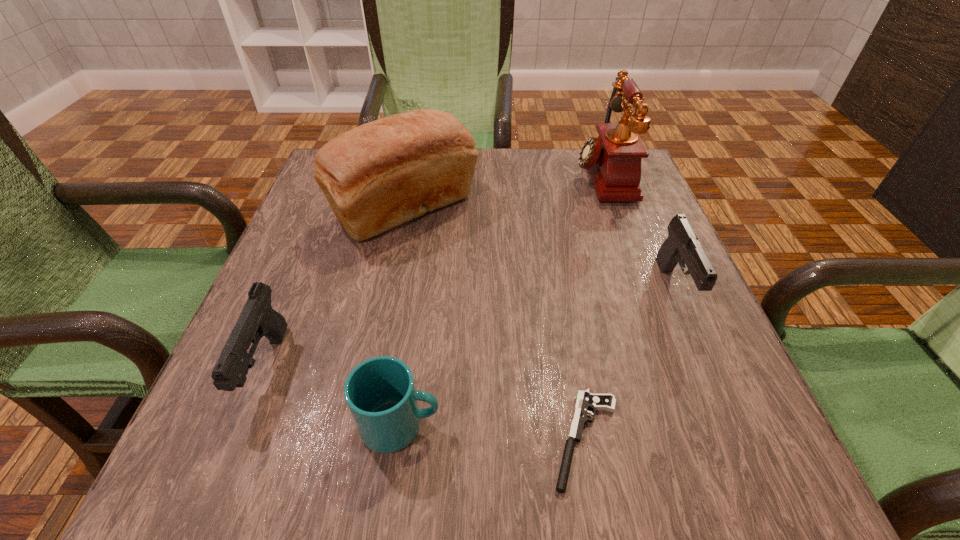
Locate an element on the screen. vacant space positioned 0.210m on the dial of the telephone is located at coordinates (492, 176).

At what (x,y) coordinates should I click in order to perform the action: click on free location located 0.090m on the back of the bread. Please return your answer as a coordinate pair (x, y). The height and width of the screenshot is (540, 960). Looking at the image, I should click on (417, 157).

Locate an element on the screen. This screenshot has width=960, height=540. vacant space situated aim along the barrel of the rightmost pistol is located at coordinates (715, 382).

At what (x,y) coordinates should I click in order to perform the action: click on vacant area situated at the barrel of the leftmost pistol. Please return your answer as a coordinate pair (x, y). This screenshot has height=540, width=960. Looking at the image, I should click on (222, 480).

You are a GUI agent. You are given a task and a screenshot of the screen. Output one action in this format:
    pyautogui.click(x=<x>, y=<y>)
    Task: Click on the free spot located on the handle side of the cup
    
    Given the screenshot: What is the action you would take?
    click(677, 425)

This screenshot has height=540, width=960. What are the coordinates of `vacant region located on the front-facing side of the fourth object from left to right` in the screenshot? It's located at (391, 439).

Identify the location of vacant space located 0.400m on the front-facing side of the fourth object from left to right. [274, 439].

The image size is (960, 540). In order to click on vacant space situated 0.190m on the front-facing side of the fourth object from left to right in this screenshot , I will do `click(419, 439)`.

What are the coordinates of `telephone that is at the far edge` in the screenshot? It's located at (613, 159).

At what (x,y) coordinates should I click in order to perform the action: click on bread located in the far edge section of the desktop. Please return your answer as a coordinate pair (x, y). The image size is (960, 540). Looking at the image, I should click on (379, 175).